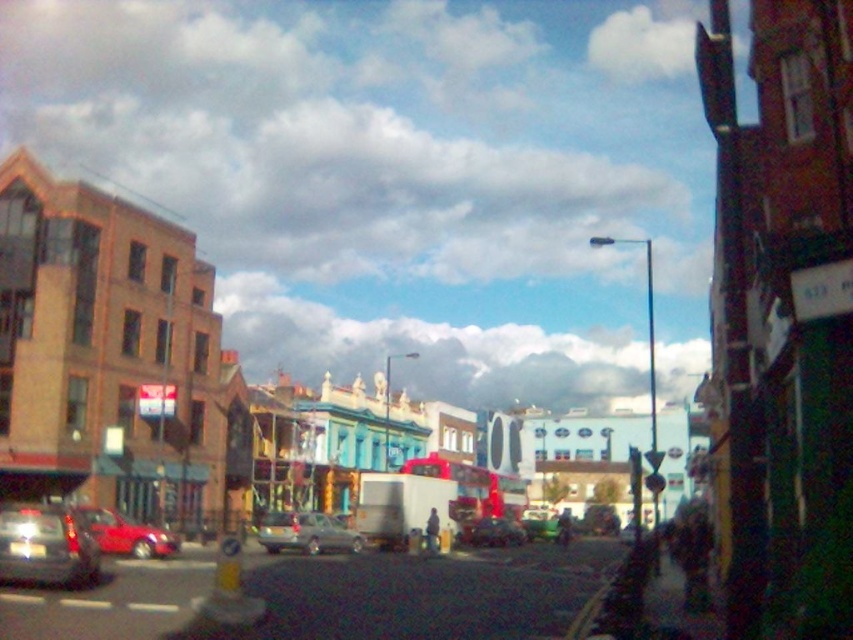
You are a delivery driver who needs to park your metallic silver car at center in a parking spot located at coordinates 0.834, 0.360. Is your car already positioned correctly?

Yes, the metallic silver car at center is already positioned at point (306, 532), so it is correctly parked in the parking spot.

You are a delivery person trying to park your truck between the shiny silver car at lower left and the shiny red car at lower left. Can you determine if there is enough space between them to fit your truck that is 2.5 meters wide?

The shiny silver car at lower left might be wider than shiny red car at lower left, but without exact width measurements, it is uncertain whether the space between them can accommodate a 2.5 meter wide truck. Further information is needed to confirm.